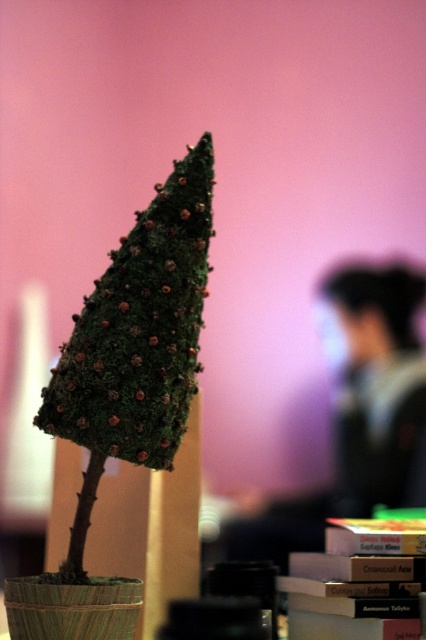
Who is higher up, dark hair at upper right or black fabric at upper center?

Positioned higher is black fabric at upper center.

Which is in front, point (370, 484) or point (397, 458)?

Point (370, 484)

Locate an element on the screen. The image size is (426, 640). dark hair at upper right is located at coordinates (354, 410).

Describe the element at coordinates (137, 342) in the screenshot. I see `green mossy cone at center` at that location.

Is the position of green mossy cone at center less distant than that of black fabric at upper center?

Yes, it is.

The height and width of the screenshot is (640, 426). I want to click on green mossy cone at center, so click(x=137, y=342).

Identify the location of green mossy cone at center. This screenshot has width=426, height=640. (137, 342).

Where is `green mossy cone at center`? This screenshot has width=426, height=640. green mossy cone at center is located at coordinates (137, 342).

Does green mossy cone at center appear on the right side of dark hair at upper right?

Incorrect, green mossy cone at center is not on the right side of dark hair at upper right.

Find the location of a particular element. green mossy cone at center is located at coordinates (137, 342).